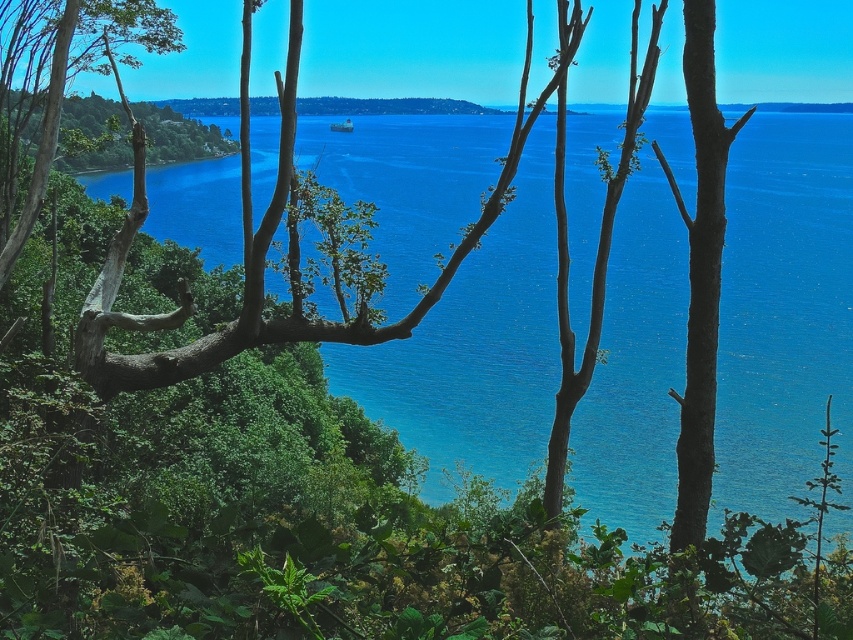
Question: Among these objects, which one is farthest from the camera?

Choices:
 (A) brown rough bark tree at right
 (B) blue water at center
 (C) green leafy tree at left

Answer: (C)

Question: Among these objects, which one is nearest to the camera?

Choices:
 (A) green leafy tree at left
 (B) blue water at center

Answer: (B)

Question: Can you confirm if blue water at center is positioned to the right of green leafy tree at left?

Choices:
 (A) no
 (B) yes

Answer: (B)

Question: Is blue water at center bigger than brown rough bark tree at right?

Choices:
 (A) no
 (B) yes

Answer: (B)

Question: Which object is positioned closest to the brown rough bark tree at right?

Choices:
 (A) blue water at center
 (B) green leafy tree at left

Answer: (B)

Question: Observing the image, what is the correct spatial positioning of blue water at center in reference to green leafy tree at left?

Choices:
 (A) left
 (B) right

Answer: (B)